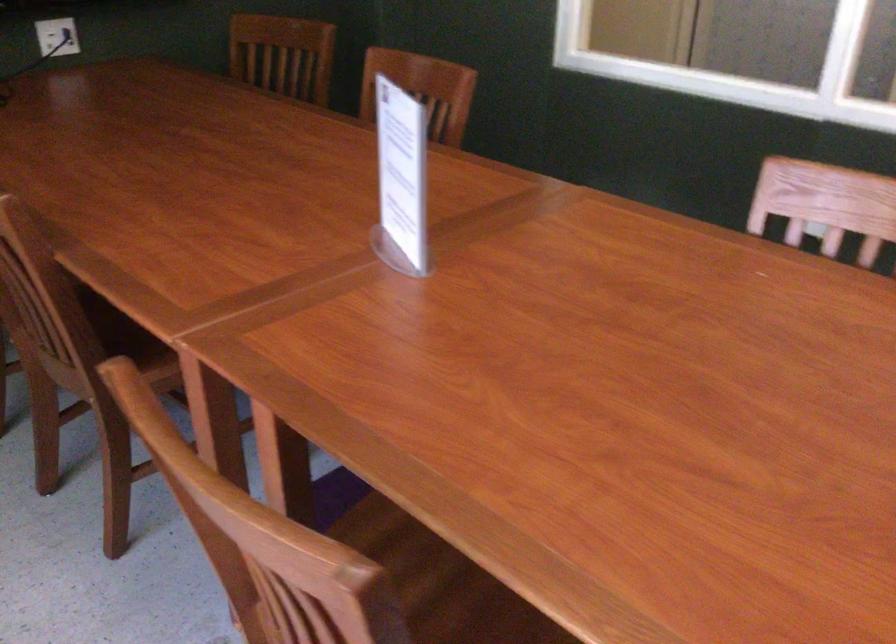
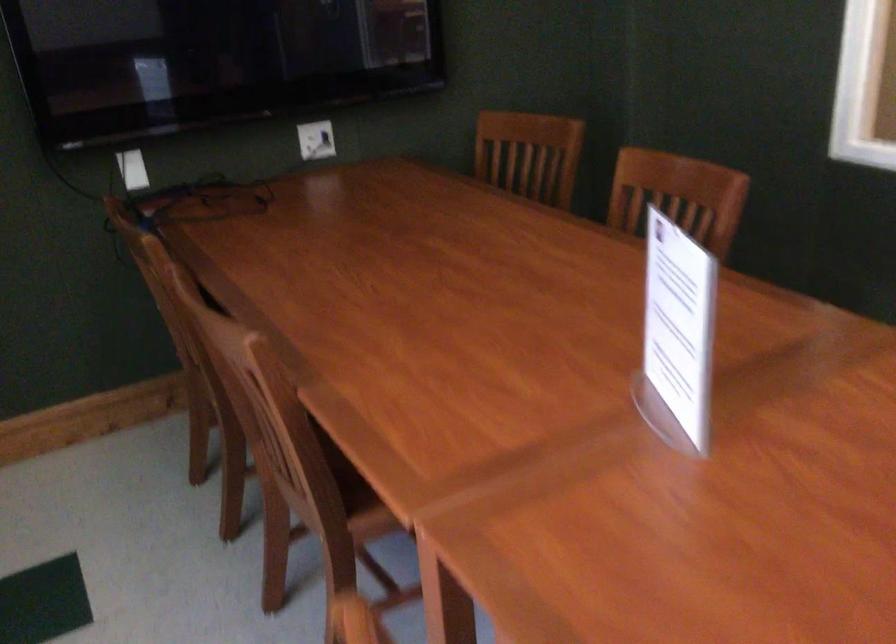
What movement of the cameraman would produce the second image?

The cameraman walked toward left, forward.